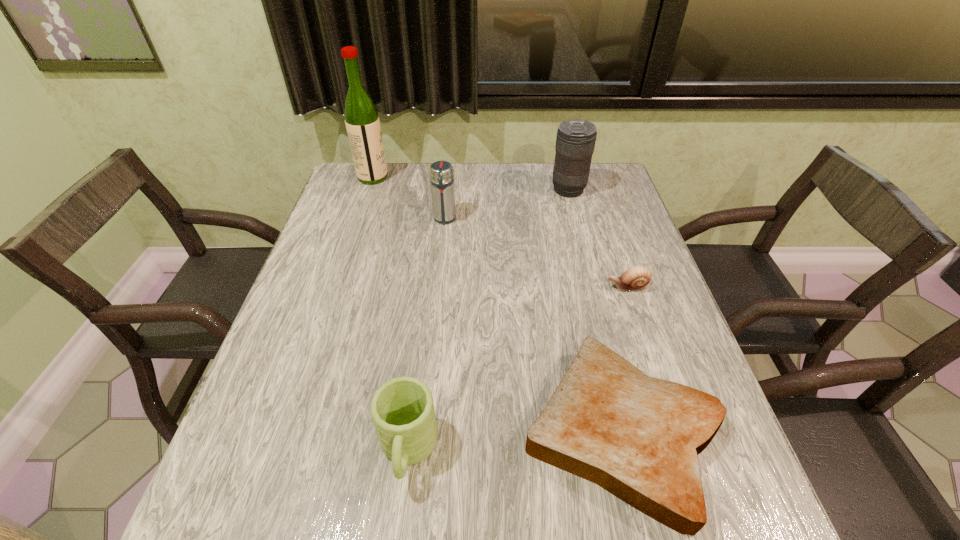
In order to click on vacant space at the right edge of the desktop in this screenshot , I will do `click(620, 309)`.

Find the location of a particular element. This screenshot has width=960, height=540. vacant space at the far left corner is located at coordinates (372, 190).

Image resolution: width=960 pixels, height=540 pixels. In order to click on free region at the far right corner of the desktop in this screenshot , I will do `click(603, 188)`.

Where is `free space between the bread and the telephoto lens`? The image size is (960, 540). free space between the bread and the telephoto lens is located at coordinates (594, 310).

Identify the location of unoccupied position between the escargot and the liquor. (500, 232).

At what (x,y) coordinates should I click in order to perform the action: click on empty space that is in between the telephoto lens and the thermos bottle. Please return your answer as a coordinate pair (x, y). The width and height of the screenshot is (960, 540). Looking at the image, I should click on (506, 204).

Locate an element on the screen. empty space that is in between the third farthest object and the bread is located at coordinates (533, 325).

Locate an element on the screen. The width and height of the screenshot is (960, 540). free area in between the leftmost object and the third nearest object is located at coordinates (500, 232).

Find the location of a particular element. This screenshot has width=960, height=540. blank region between the second tallest object and the tallest object is located at coordinates (470, 184).

Where is `vacant area between the fourth tallest object and the fourth nearest object`? This screenshot has height=540, width=960. vacant area between the fourth tallest object and the fourth nearest object is located at coordinates (426, 335).